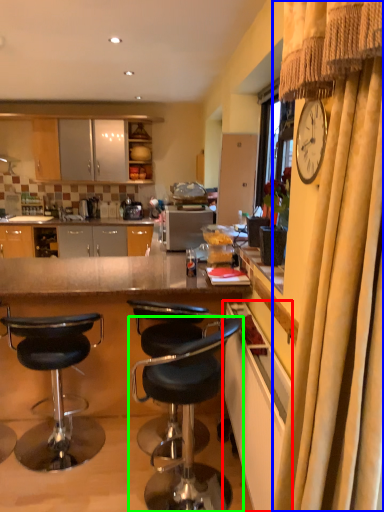
Question: Which object is the farthest from cabinetry (highlighted by a red box)? Choose among these: curtain (highlighted by a blue box) or chair (highlighted by a green box).

Choices:
 (A) curtain
 (B) chair

Answer: (A)